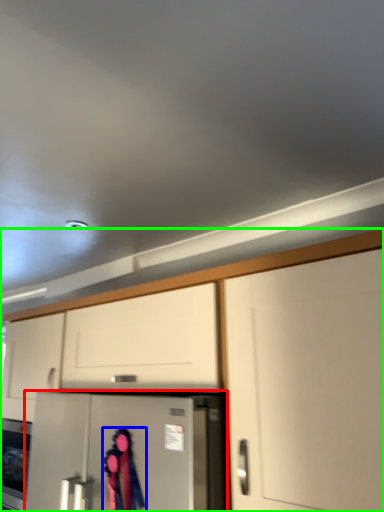
Question: Which is farther away from refrigerator (highlighted by a red box)? woman (highlighted by a blue box) or cabinetry (highlighted by a green box)?

Choices:
 (A) woman
 (B) cabinetry

Answer: (B)